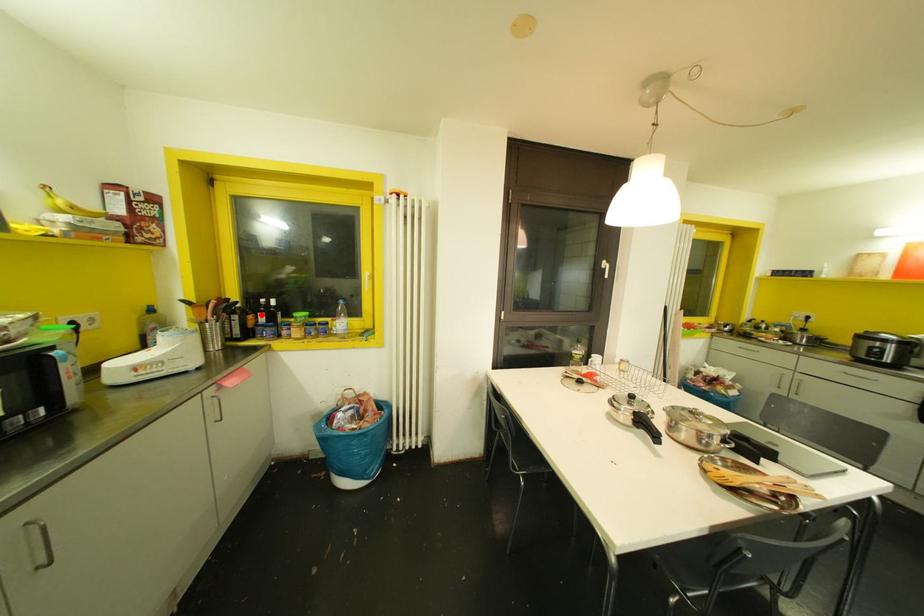
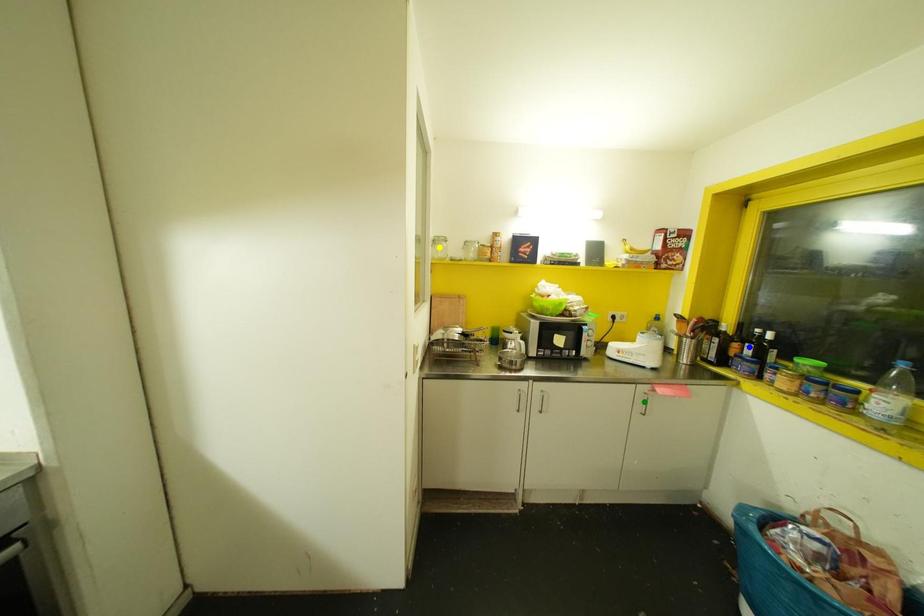
Question: I am providing you with two images of the same scene from different viewpoints. A red point is marked on the first image. You are given multiple points on the second image. Which spot in image 2 lines up with the point in image 1?

Choices:
 (A) yellow point
 (B) green point
 (C) blue point

Answer: (C)